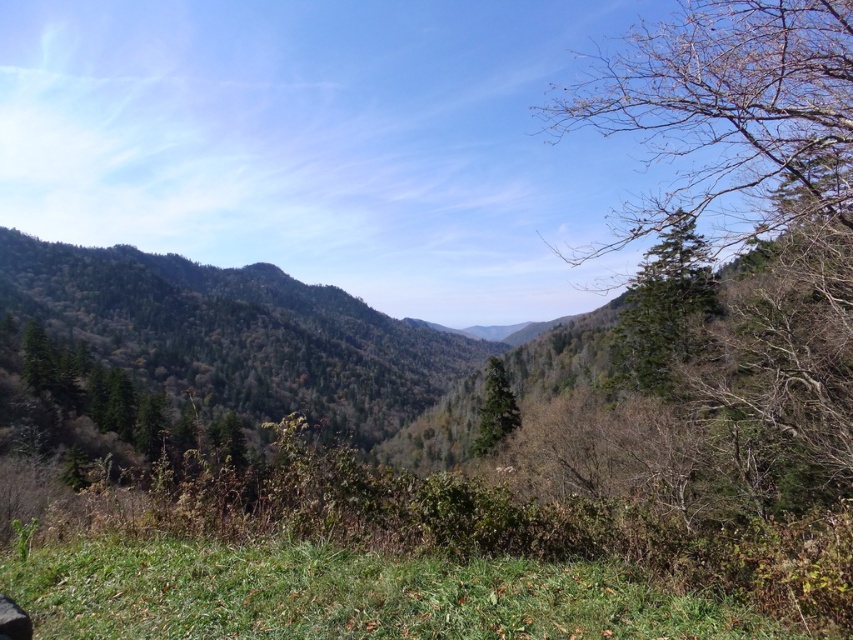
Looking at this image, you are an artist planning to paint the scene. You notice the bare branches at upper right and the green matte tree at upper right. Which one do you think will require more horizontal space on your canvas to accurately depict their full width?

The bare branches at upper right have a greater width than the green matte tree at upper right, so you will need more horizontal space to accurately depict their full width.

You are an environmental scientist studying the mountain ecosystem. You observe the bare branches at upper right and the green matte tree at upper right in the image. Which of these two trees is positioned higher in the image?

The bare branches at upper right is located above the green matte tree at upper right, so it is positioned higher in the image.

You are an environmental scientist observing the mountain landscape. You notice the bare branches at upper right and the green matte tree at center. Based on their positions, which one is closer to you?

The bare branches at upper right is closer to you because it is in front of the green matte tree at center.